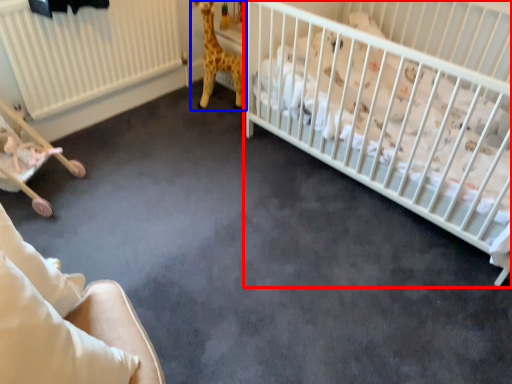
Question: Which point is further to the camera, infant bed (highlighted by a red box) or giraffe (highlighted by a blue box)?

Choices:
 (A) infant bed
 (B) giraffe

Answer: (B)